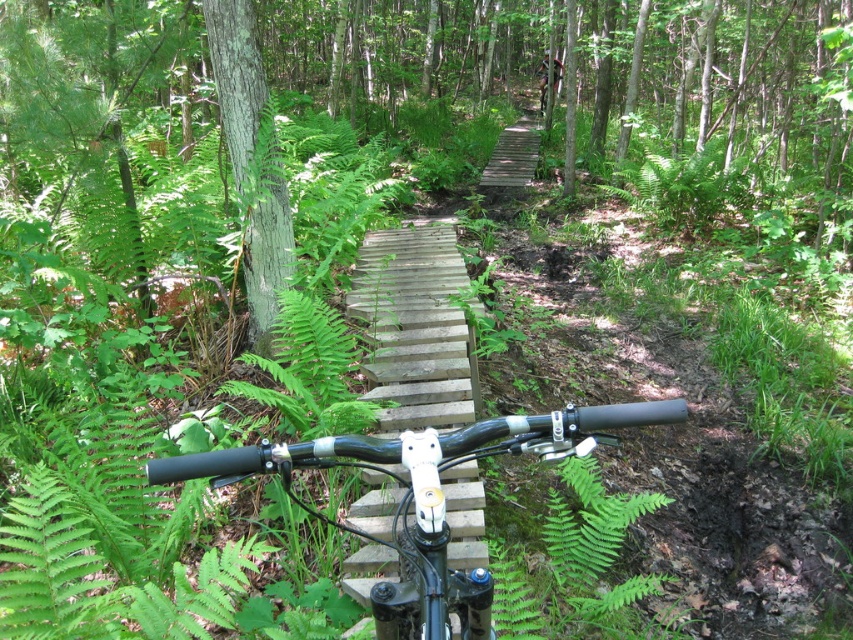
You are riding a mountain bike on a narrow wooden bridge in a forest. You notice a point marked at coordinates (425,499). Which object on your bike corresponds to this point?

The black matte handlebars at center correspond to the point marked at coordinates (425,499).

You are riding a mountain bike on a narrow wooden bridge in a forest. You notice a point at coordinates (x=425, y=499). What object is located at this point?

The point at coordinates (x=425, y=499) corresponds to the black matte handlebars at center.